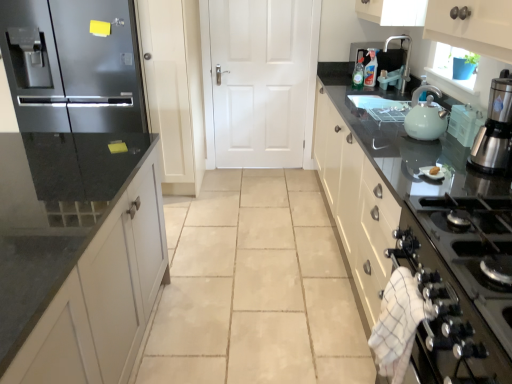
Question: Does white glossy gas stove at lower right have a greater width compared to stainless steel coffee maker at upper right?

Choices:
 (A) no
 (B) yes

Answer: (B)

Question: Considering the relative sizes of white glossy gas stove at lower right and stainless steel coffee maker at upper right in the image provided, is white glossy gas stove at lower right taller than stainless steel coffee maker at upper right?

Choices:
 (A) yes
 (B) no

Answer: (B)

Question: Are white glossy gas stove at lower right and stainless steel coffee maker at upper right beside each other?

Choices:
 (A) no
 (B) yes

Answer: (A)

Question: Is white glossy gas stove at lower right looking in the opposite direction of stainless steel coffee maker at upper right?

Choices:
 (A) yes
 (B) no

Answer: (B)

Question: Is white glossy gas stove at lower right bigger than stainless steel coffee maker at upper right?

Choices:
 (A) yes
 (B) no

Answer: (A)

Question: Considering the relative positions of white glossy gas stove at lower right and stainless steel coffee maker at upper right in the image provided, is white glossy gas stove at lower right to the left of stainless steel coffee maker at upper right from the viewer's perspective?

Choices:
 (A) no
 (B) yes

Answer: (B)

Question: From a real-world perspective, is stainless steel coffee maker at upper right physically below matte white kettle at right?

Choices:
 (A) no
 (B) yes

Answer: (A)

Question: Considering the relative sizes of stainless steel coffee maker at upper right and matte white kettle at right in the image provided, is stainless steel coffee maker at upper right bigger than matte white kettle at right?

Choices:
 (A) no
 (B) yes

Answer: (B)

Question: Is matte white kettle at right at the back of stainless steel coffee maker at upper right?

Choices:
 (A) no
 (B) yes

Answer: (A)

Question: Is matte white kettle at right a part of stainless steel coffee maker at upper right?

Choices:
 (A) yes
 (B) no

Answer: (B)

Question: Does stainless steel coffee maker at upper right appear on the right side of matte white kettle at right?

Choices:
 (A) no
 (B) yes

Answer: (B)

Question: Is stainless steel coffee maker at upper right smaller than matte white kettle at right?

Choices:
 (A) yes
 (B) no

Answer: (B)

Question: Can you confirm if stainless steel coffee maker at upper right is thinner than matte black refrigerator at left?

Choices:
 (A) no
 (B) yes

Answer: (B)